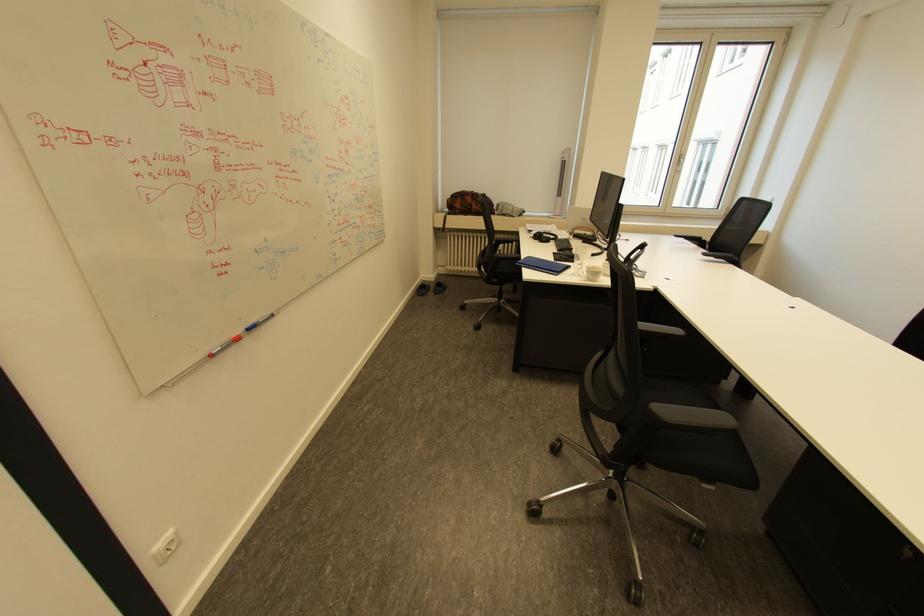
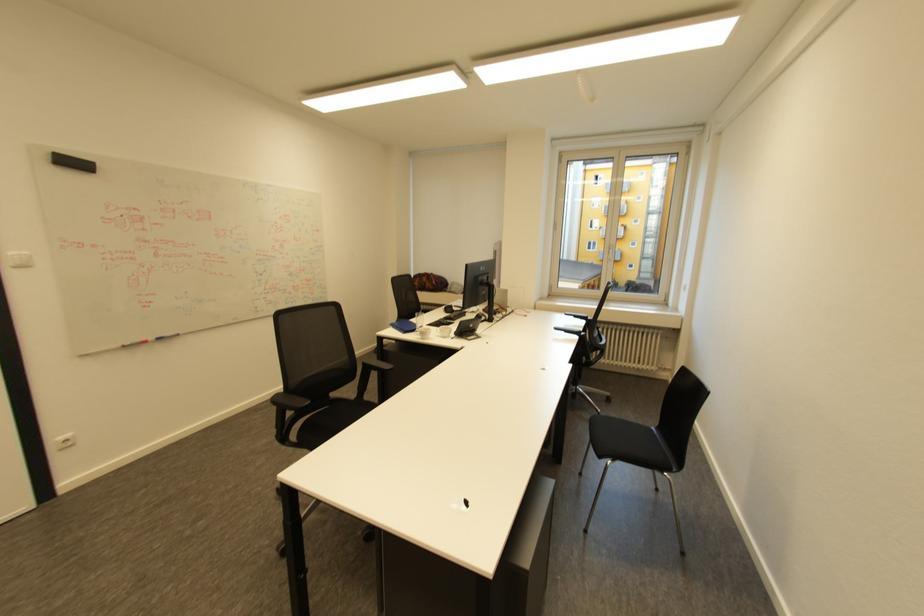
Question: What movement of the cameraman would produce the second image?

Choices:
 (A) Left
 (B) Right
 (C) Forward
 (D) Backward

Answer: (B)